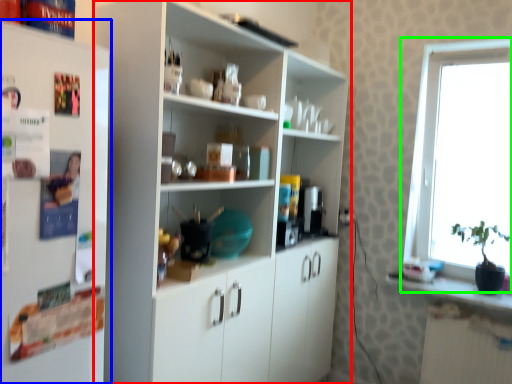
Question: Estimate the real-world distances between objects in this image. Which object is farther from cupboard (highlighted by a red box), refrigerator (highlighted by a blue box) or window (highlighted by a green box)?

Choices:
 (A) refrigerator
 (B) window

Answer: (B)